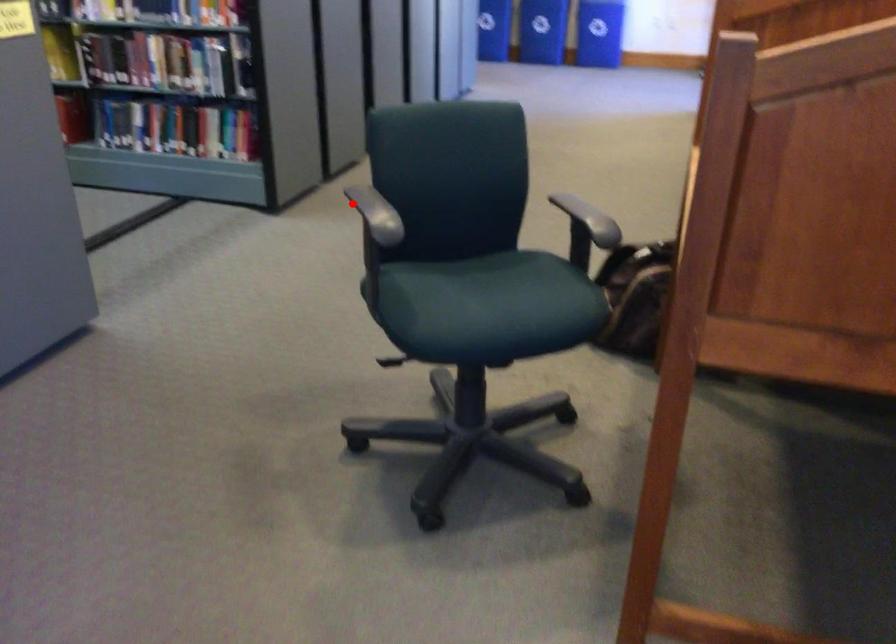
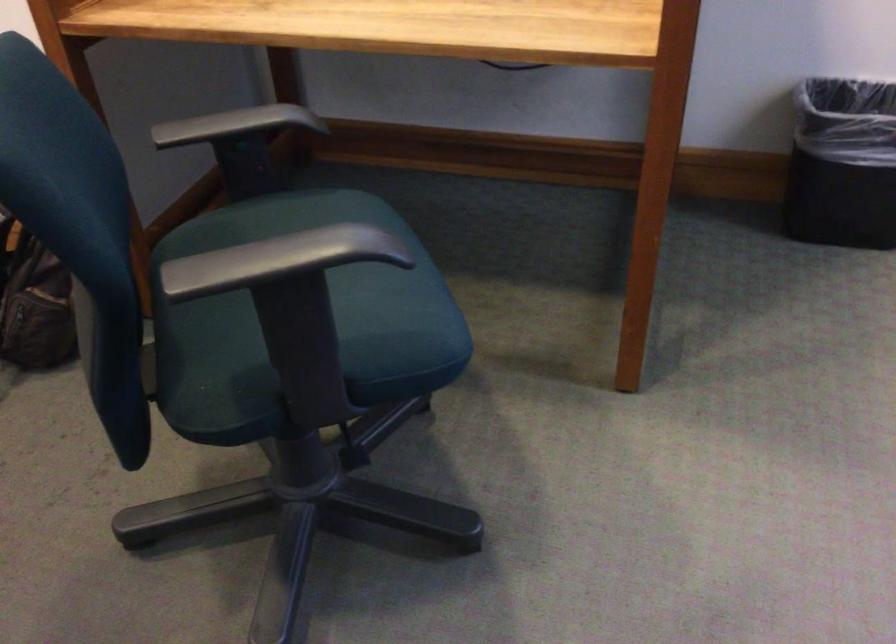
Locate, in the second image, the point that corresponds to the highlighted location in the first image.

(250, 265)